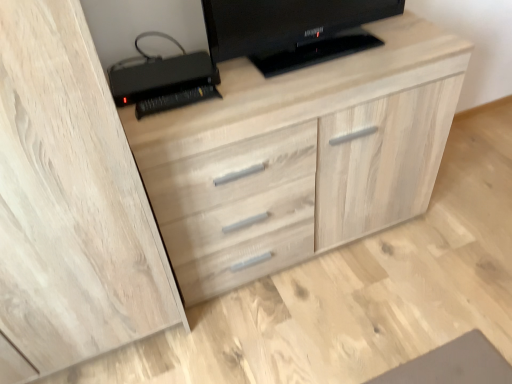
Measure the distance between point (412, 142) and camera.

Point (412, 142) and camera are 4.59 feet apart from each other.

Describe the element at coordinates (291, 30) in the screenshot. I see `black glossy television at upper center` at that location.

You are a GUI agent. You are given a task and a screenshot of the screen. Output one action in this format:
    pyautogui.click(x=<x>, y=<y>)
    Task: Click on the black plastic printer at upper left
    The width and height of the screenshot is (512, 384).
    Given the screenshot: What is the action you would take?
    pyautogui.click(x=163, y=79)

Is point (345, 27) closer to viewer compared to point (226, 205)?

No, it is behind (226, 205).

From a real-world perspective, is black glossy television at upper center above or below light wood dresser at center?

Clearly, from a real-world perspective, black glossy television at upper center is above light wood dresser at center.

From the picture: Would you say black glossy television at upper center is inside or outside light wood dresser at center?

The correct answer is: outside.

Where is `television that appears behind the light wood dresser at center`? television that appears behind the light wood dresser at center is located at coordinates (291, 30).

From a real-world perspective, is light wood dresser at center below black plastic printer at upper left?

Correct, in the physical world, light wood dresser at center is lower than black plastic printer at upper left.

From the image's perspective, is light wood dresser at center above or below black plastic printer at upper left?

light wood dresser at center is situated lower than black plastic printer at upper left in the image.

Does light wood dresser at center have a greater height compared to black plastic printer at upper left?

Yes, light wood dresser at center is taller than black plastic printer at upper left.

Between light wood dresser at center and black plastic printer at upper left, which one appears on the right side from the viewer's perspective?

light wood dresser at center is more to the right.

Can you tell me how much black plastic printer at upper left and black glossy television at upper center differ in facing direction?

There is a 1.35-degree angle between the facing directions of black plastic printer at upper left and black glossy television at upper center.

From a real-world perspective, which object stands above the other?

black glossy television at upper center is physically above.

Is black plastic printer at upper left with black glossy television at upper center?

No, black plastic printer at upper left is not beside black glossy television at upper center.

From the image's perspective, which one is positioned higher, black plastic printer at upper left or black glossy television at upper center?

black glossy television at upper center is shown above in the image.

Considering their positions, is black plastic printer at upper left located in front of or behind light wood dresser at center?

black plastic printer at upper left is behind light wood dresser at center.

How different are the orientations of black plastic printer at upper left and light wood dresser at center in degrees?

The angular difference between black plastic printer at upper left and light wood dresser at center is 3.66 degrees.

Can you confirm if black plastic printer at upper left is thinner than light wood dresser at center?

Indeed, black plastic printer at upper left has a lesser width compared to light wood dresser at center.

Is the surface of black plastic printer at upper left in direct contact with light wood dresser at center?

No, black plastic printer at upper left is not making contact with light wood dresser at center.

Considering the relative sizes of light wood dresser at center and black glossy television at upper center in the image provided, is light wood dresser at center taller than black glossy television at upper center?

Correct, light wood dresser at center is much taller as black glossy television at upper center.

Considering the points (222, 174) and (319, 15), which point is behind, point (222, 174) or point (319, 15)?

The point (319, 15) is farther from the camera.

From the image's perspective, between light wood dresser at center and black glossy television at upper center, which one is located above?

black glossy television at upper center is shown above in the image.

Considering the relative positions of black glossy television at upper center and black plastic printer at upper left in the image provided, is black glossy television at upper center behind black plastic printer at upper left?

That is False.

From a real-world perspective, is black glossy television at upper center above or below black plastic printer at upper left?

In terms of real-world spatial position, black glossy television at upper center is above black plastic printer at upper left.

Is black glossy television at upper center positioned with its back to black plastic printer at upper left?

No, black plastic printer at upper left is not at the back of black glossy television at upper center.

Considering the sizes of black glossy television at upper center and black plastic printer at upper left in the image, is black glossy television at upper center taller or shorter than black plastic printer at upper left?

black glossy television at upper center is taller than black plastic printer at upper left.

Image resolution: width=512 pixels, height=384 pixels. In order to click on television behind the light wood dresser at center in this screenshot , I will do `click(291, 30)`.

Identify the location of computer that is above the light wood dresser at center (from a real-world perspective). (163, 79).

From the image, which object appears to be nearer to black plastic printer at upper left, black glossy television at upper center or light wood dresser at center?

The object closer to black plastic printer at upper left is black glossy television at upper center.

Estimate the real-world distances between objects in this image. Which object is closer to black glossy television at upper center, black plastic printer at upper left or light wood dresser at center?

black plastic printer at upper left.

Based on the photo, when comparing their distances from black plastic printer at upper left, does light wood dresser at center or black glossy television at upper center seem closer?

black glossy television at upper center is positioned closer to the anchor black plastic printer at upper left.

From the image, which object appears to be nearer to light wood dresser at center, black glossy television at upper center or black plastic printer at upper left?

A: black glossy television at upper center is closer to light wood dresser at center.

When comparing their distances from black glossy television at upper center, does light wood dresser at center or black plastic printer at upper left seem further?

light wood dresser at center lies further to black glossy television at upper center than the other object.

Based on their spatial positions, is black plastic printer at upper left or black glossy television at upper center closer to light wood dresser at center?

black glossy television at upper center lies closer to light wood dresser at center than the other object.

Where is `dresser between black plastic printer at upper left and black glossy television at upper center from left to right`? The width and height of the screenshot is (512, 384). dresser between black plastic printer at upper left and black glossy television at upper center from left to right is located at coordinates (300, 187).